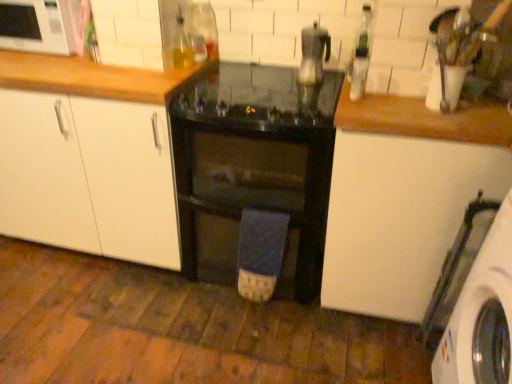
Question: From a real-world perspective, is white matte cabinet at center, marked as the 1th cabinetry in a left-to-right arrangement, positioned over white glossy microwave at upper left based on gravity?

Choices:
 (A) no
 (B) yes

Answer: (A)

Question: Is the position of white matte cabinet at center, marked as the 1th cabinetry in a left-to-right arrangement, less distant than that of white glossy microwave at upper left?

Choices:
 (A) yes
 (B) no

Answer: (A)

Question: Considering the relative positions of white matte cabinet at center, marked as the 1th cabinetry in a left-to-right arrangement, and white glossy microwave at upper left in the image provided, is white matte cabinet at center, marked as the 1th cabinetry in a left-to-right arrangement, to the right of white glossy microwave at upper left from the viewer's perspective?

Choices:
 (A) no
 (B) yes

Answer: (B)

Question: From a real-world perspective, is white matte cabinet at center, marked as the 1th cabinetry in a left-to-right arrangement, positioned under white glossy microwave at upper left based on gravity?

Choices:
 (A) yes
 (B) no

Answer: (A)

Question: Is white matte cabinet at center, marked as the 1th cabinetry in a left-to-right arrangement, to the left of white glossy microwave at upper left from the viewer's perspective?

Choices:
 (A) no
 (B) yes

Answer: (A)

Question: Can you confirm if white matte cabinet at center, marked as the 1th cabinetry in a left-to-right arrangement, is smaller than white glossy microwave at upper left?

Choices:
 (A) no
 (B) yes

Answer: (A)

Question: Is white glossy microwave at upper left completely or partially inside white matte cabinet at upper right, the third cabinetry positioned from the left?

Choices:
 (A) yes
 (B) no

Answer: (B)

Question: Considering the relative sizes of white matte cabinet at upper right, the third cabinetry positioned from the left, and white glossy microwave at upper left in the image provided, is white matte cabinet at upper right, the third cabinetry positioned from the left, thinner than white glossy microwave at upper left?

Choices:
 (A) no
 (B) yes

Answer: (A)

Question: Is white matte cabinet at upper right, positioned as the 1th cabinetry in right-to-left order, outside of white glossy microwave at upper left?

Choices:
 (A) no
 (B) yes

Answer: (B)

Question: Does white matte cabinet at upper right, positioned as the 1th cabinetry in right-to-left order, have a larger size compared to white glossy microwave at upper left?

Choices:
 (A) yes
 (B) no

Answer: (A)

Question: Is the position of white matte cabinet at upper right, positioned as the 1th cabinetry in right-to-left order, more distant than that of white glossy microwave at upper left?

Choices:
 (A) yes
 (B) no

Answer: (B)

Question: Is the position of white matte cabinet at upper right, the third cabinetry positioned from the left, less distant than that of white glossy microwave at upper left?

Choices:
 (A) no
 (B) yes

Answer: (B)

Question: From a real-world perspective, is translucent glass bottle at upper center, marked as the third bottle in a right-to-left arrangement, located beneath white matte cabinet at center, marked as the 1th cabinetry in a left-to-right arrangement?

Choices:
 (A) yes
 (B) no

Answer: (B)